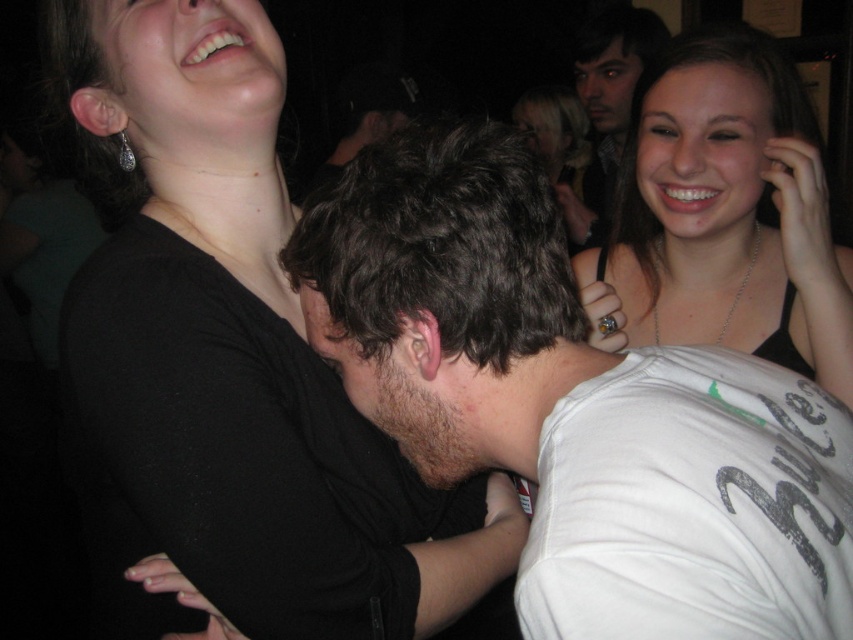
Question: Which object is closer to the camera taking this photo?

Choices:
 (A) matte black tank top at upper right
 (B) black matte shirt at upper left
 (C) smooth brown hair at upper right

Answer: (B)

Question: Can you confirm if black matte shirt at upper left is wider than dark brown hair at center?

Choices:
 (A) yes
 (B) no

Answer: (A)

Question: Which is nearer to the matte black tank top at upper right?

Choices:
 (A) black matte shirt at upper left
 (B) smooth brown hair at upper right

Answer: (A)

Question: Is black matte shirt at upper left closer to camera compared to dark brown hair at center?

Choices:
 (A) no
 (B) yes

Answer: (A)

Question: Is matte black tank top at upper right below smooth brown hair at upper right?

Choices:
 (A) no
 (B) yes

Answer: (B)

Question: Which object is farther from the camera taking this photo?

Choices:
 (A) dark brown hair at center
 (B) smooth brown hair at upper right

Answer: (B)